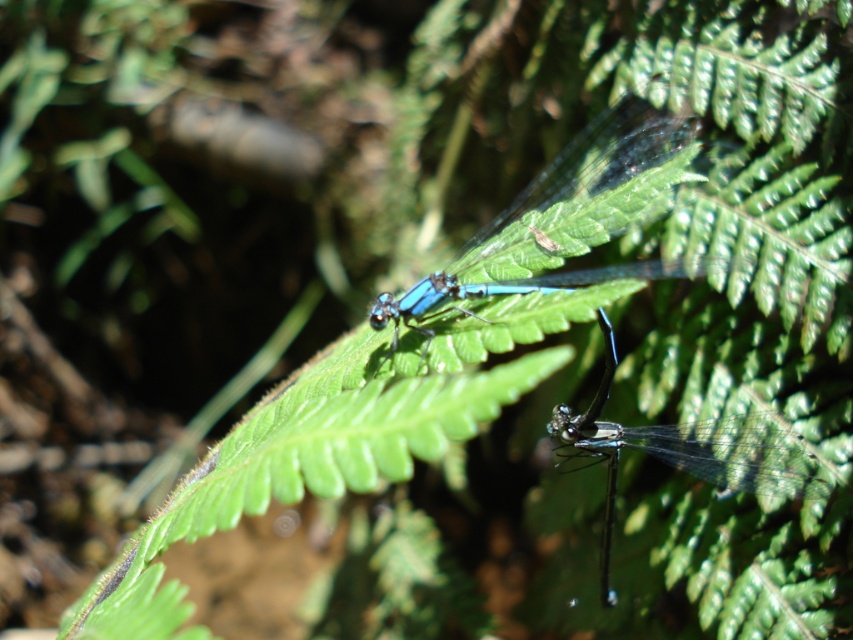
Question: Among these objects, which one is nearest to the camera?

Choices:
 (A) transparent glass dragonfly at center
 (B) blue translucent dragonfly at center

Answer: (A)

Question: Is blue translucent dragonfly at center bigger than transparent glass dragonfly at center?

Choices:
 (A) yes
 (B) no

Answer: (A)

Question: Among these points, which one is farthest from the camera?

Choices:
 (A) (775, 486)
 (B) (613, 193)

Answer: (B)

Question: Considering the relative positions of blue translucent dragonfly at center and transparent glass dragonfly at center in the image provided, where is blue translucent dragonfly at center located with respect to transparent glass dragonfly at center?

Choices:
 (A) below
 (B) above

Answer: (B)

Question: Does blue translucent dragonfly at center appear under transparent glass dragonfly at center?

Choices:
 (A) yes
 (B) no

Answer: (B)